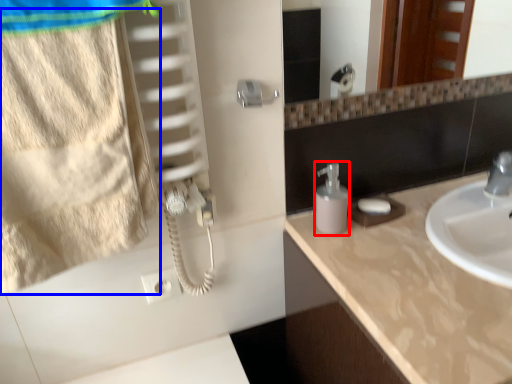
Question: Which of the following is the farthest to the observer, soap dispenser (highlighted by a red box) or beach towel (highlighted by a blue box)?

Choices:
 (A) soap dispenser
 (B) beach towel

Answer: (A)